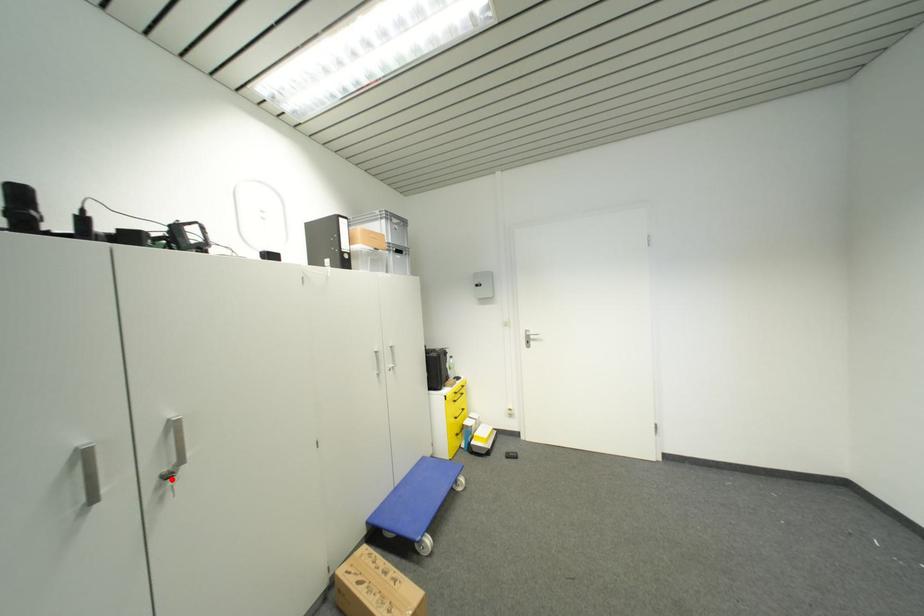
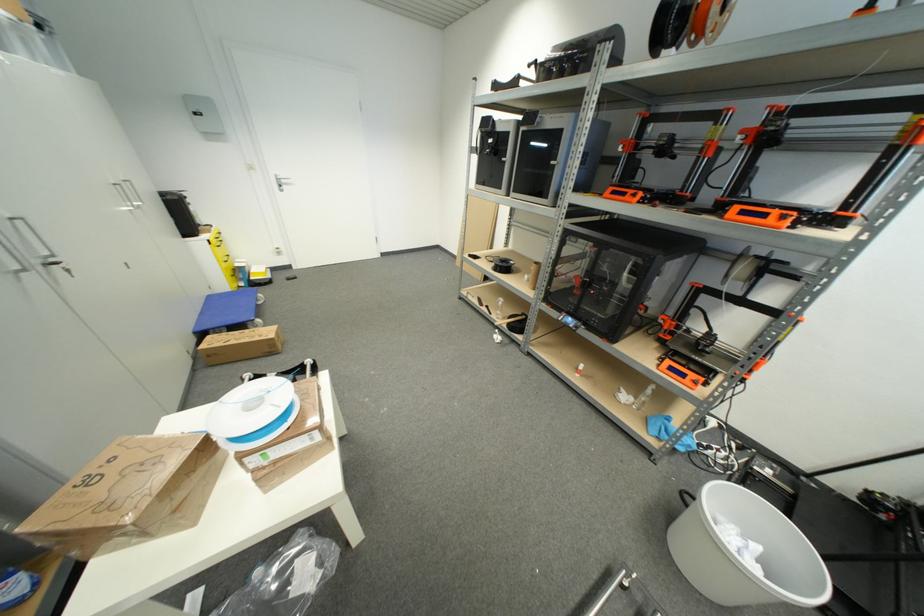
The point at the highlighted location is marked in the first image. Where is the corresponding point in the second image?

(59, 265)